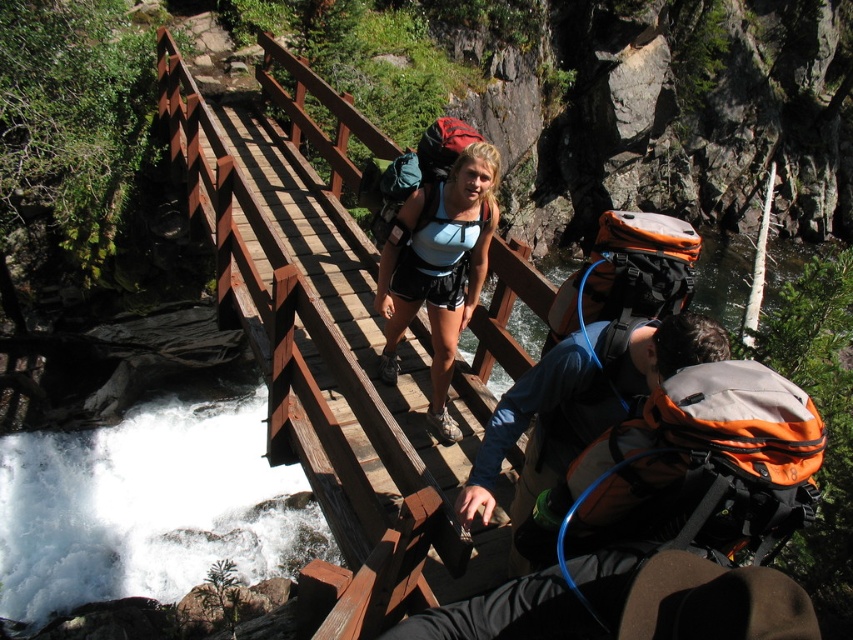
You are a drone operator tasked with capturing aerial footage of the brown wooden bridge at center. The drone must hover exactly above the bridge to get the best shot. Given the coordinates provided, what are the exact coordinates where the drone should hover?

The drone should hover at the coordinates provided in the description, which are point (326, 340), to capture the best aerial footage of the brown wooden bridge at center.